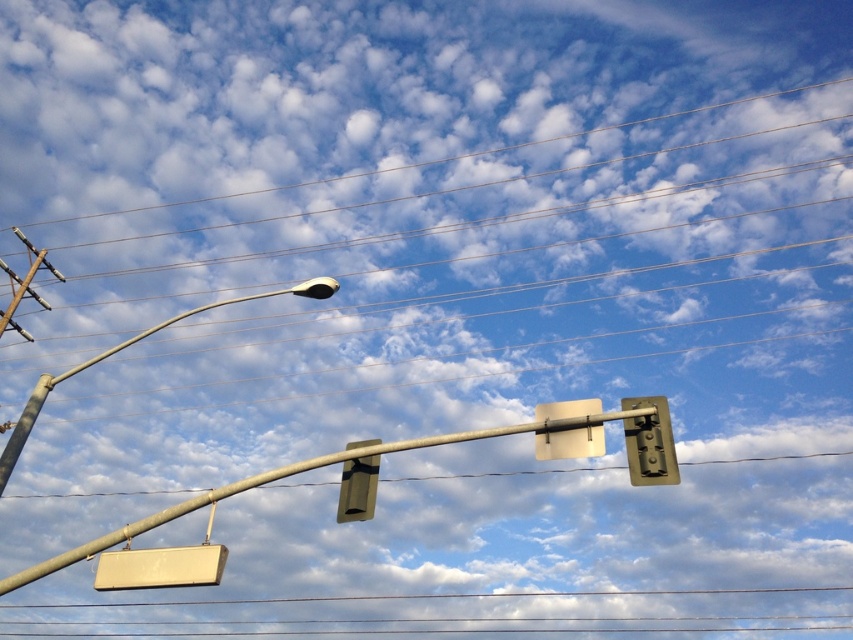
Question: Among these objects, which one is nearest to the camera?

Choices:
 (A) metallic silver traffic light at center
 (B) metallic gold traffic light at upper right
 (C) metallic traffic light at center
 (D) sleek metallic street light at upper left

Answer: (B)

Question: Estimate the real-world distances between objects in this image. Which object is closer to the metallic gold traffic light at upper right?

Choices:
 (A) metallic silver traffic light at center
 (B) white matte sign at lower left
 (C) metallic traffic light at center
 (D) sleek metallic street light at upper left

Answer: (A)

Question: Observing the image, what is the correct spatial positioning of white matte sign at lower left in reference to metallic silver traffic light at center?

Choices:
 (A) left
 (B) right

Answer: (A)

Question: Among these points, which one is farthest from the camera?

Choices:
 (A) [334, 289]
 (B) [338, 509]
 (C) [648, 424]
 (D) [540, 442]

Answer: (A)

Question: Considering the relative positions of metallic silver traffic light at center and metallic traffic light at center in the image provided, where is metallic silver traffic light at center located with respect to metallic traffic light at center?

Choices:
 (A) left
 (B) right

Answer: (B)

Question: Can you confirm if white matte sign at lower left is positioned to the right of metallic gold traffic light at upper right?

Choices:
 (A) no
 (B) yes

Answer: (A)